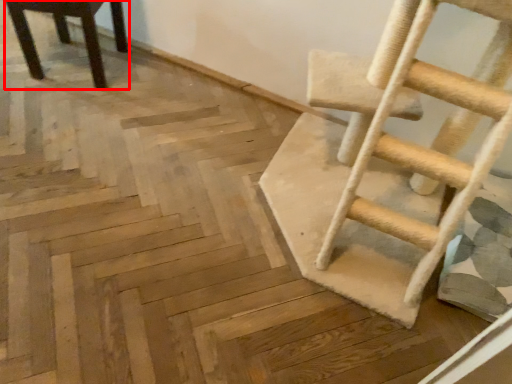
Question: Considering the relative positions of chair (annotated by the red box) and ladder in the image provided, where is chair (annotated by the red box) located with respect to the staircase?

Choices:
 (A) right
 (B) left

Answer: (B)